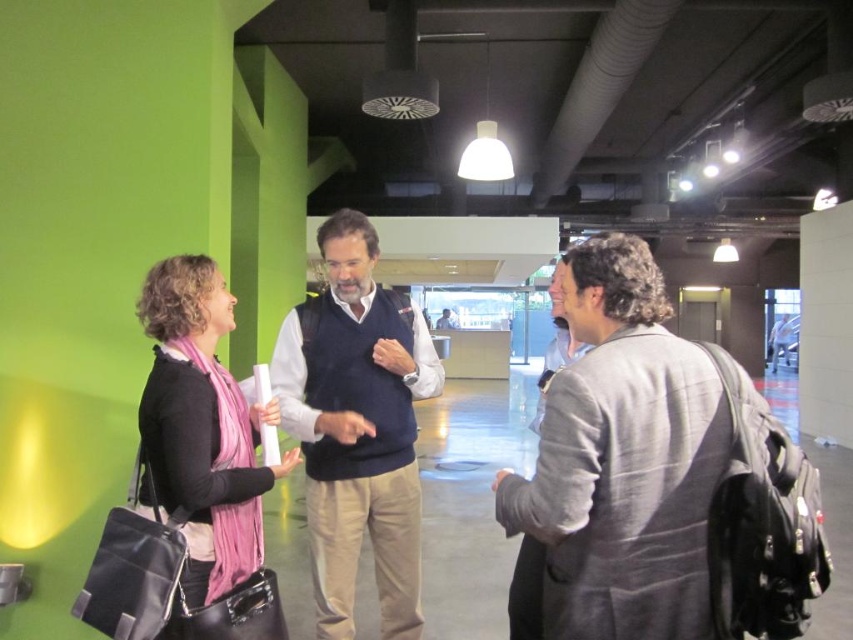
Can you confirm if gray woolen blazer at right is bigger than dark blue sweater vest at center?

Incorrect, gray woolen blazer at right is not larger than dark blue sweater vest at center.

Between gray woolen blazer at right and dark blue sweater vest at center, which one is positioned higher?

gray woolen blazer at right is above.

Identify the location of gray woolen blazer at right. (622, 460).

What are the coordinates of `gray woolen blazer at right` in the screenshot? It's located at (622, 460).

Which is below, dark blue sweater vest at center or pink scarf at left?

dark blue sweater vest at center

What do you see at coordinates (357, 428) in the screenshot? This screenshot has width=853, height=640. I see `dark blue sweater vest at center` at bounding box center [357, 428].

Where is `dark blue sweater vest at center`? Image resolution: width=853 pixels, height=640 pixels. dark blue sweater vest at center is located at coordinates (357, 428).

Can you confirm if gray woolen blazer at right is taller than pink scarf at left?

Incorrect, gray woolen blazer at right's height is not larger of pink scarf at left's.

At what (x,y) coordinates should I click in order to perform the action: click on gray woolen blazer at right. Please return your answer as a coordinate pair (x, y). Looking at the image, I should click on (x=622, y=460).

Identify the location of gray woolen blazer at right. The width and height of the screenshot is (853, 640). (622, 460).